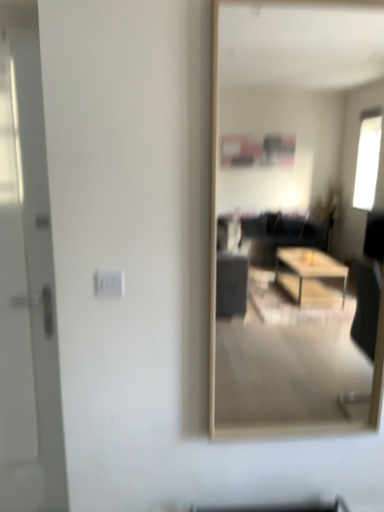
Question: From the image's perspective, is white glossy door at left over transparent glass mirror at center?

Choices:
 (A) no
 (B) yes

Answer: (A)

Question: Does white glossy door at left turn towards transparent glass mirror at center?

Choices:
 (A) yes
 (B) no

Answer: (B)

Question: Considering the relative positions of white glossy door at left and transparent glass mirror at center in the image provided, is white glossy door at left to the right of transparent glass mirror at center from the viewer's perspective?

Choices:
 (A) no
 (B) yes

Answer: (A)

Question: Is white glossy door at left not near transparent glass mirror at center?

Choices:
 (A) no
 (B) yes

Answer: (B)

Question: Is the position of white glossy door at left more distant than that of transparent glass mirror at center?

Choices:
 (A) no
 (B) yes

Answer: (B)

Question: Visually, is white plastic electric outlet at center positioned to the left or to the right of transparent glass mirror at center?

Choices:
 (A) right
 (B) left

Answer: (B)

Question: Considering the positions of white plastic electric outlet at center and transparent glass mirror at center in the image, is white plastic electric outlet at center bigger or smaller than transparent glass mirror at center?

Choices:
 (A) big
 (B) small

Answer: (B)

Question: Is point (97, 279) positioned closer to the camera than point (241, 2)?

Choices:
 (A) farther
 (B) closer

Answer: (B)

Question: Is white plastic electric outlet at center taller or shorter than transparent glass mirror at center?

Choices:
 (A) tall
 (B) short

Answer: (B)

Question: In terms of width, does transparent glass mirror at center look wider or thinner when compared to white plastic electric outlet at center?

Choices:
 (A) wide
 (B) thin

Answer: (A)

Question: From the image's perspective, relative to white plastic electric outlet at center, is transparent glass mirror at center above or below?

Choices:
 (A) below
 (B) above

Answer: (B)

Question: From a real-world perspective, is transparent glass mirror at center physically located above or below white plastic electric outlet at center?

Choices:
 (A) below
 (B) above

Answer: (B)

Question: Is transparent glass mirror at center to the left or to the right of white plastic electric outlet at center in the image?

Choices:
 (A) right
 (B) left

Answer: (A)

Question: From a real-world perspective, is white glossy door at left positioned above or below transparent glass mirror at center?

Choices:
 (A) below
 (B) above

Answer: (A)

Question: From the image's perspective, is white glossy door at left located above or below transparent glass mirror at center?

Choices:
 (A) below
 (B) above

Answer: (A)